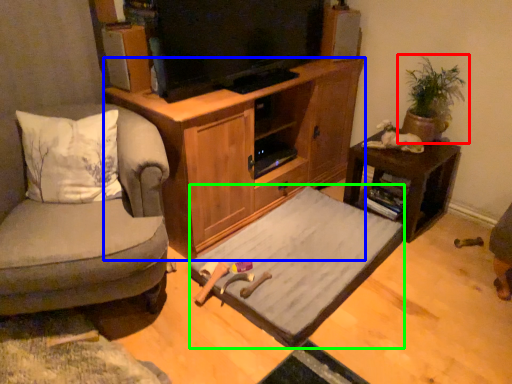
Question: Which is nearer to the houseplant (highlighted by a red box)? cabinetry (highlighted by a blue box) or bed frame (highlighted by a green box).

Choices:
 (A) cabinetry
 (B) bed frame

Answer: (A)